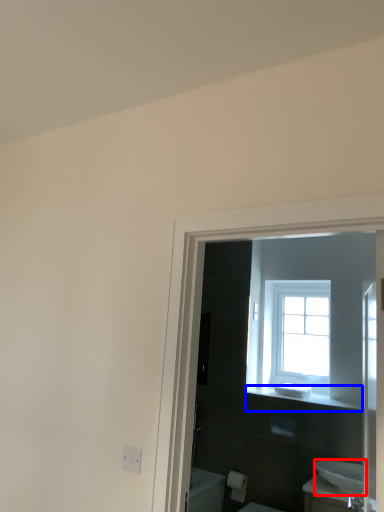
Question: Which point is further to the camera, sink (highlighted by a red box) or balustrade (highlighted by a blue box)?

Choices:
 (A) sink
 (B) balustrade

Answer: (B)